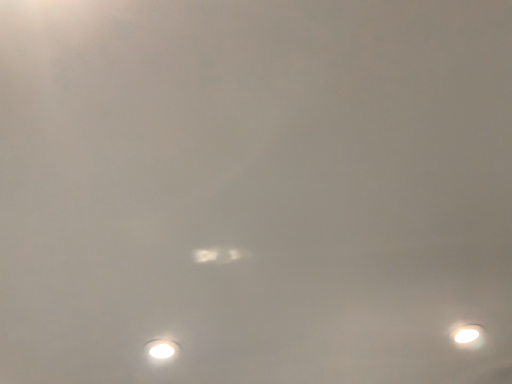
Question: Should I look upward or downward to see white glossy lamp at lower right?

Choices:
 (A) up
 (B) down

Answer: (B)